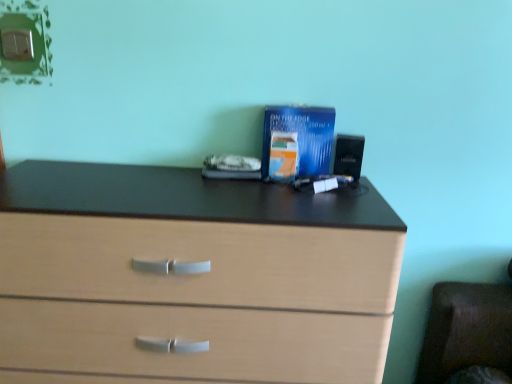
Question: Considering the relative positions of blue glossy paperback book at center, the first paperback book positioned from the back, and light wood chest of drawers at center in the image provided, is blue glossy paperback book at center, the first paperback book positioned from the back, to the left of light wood chest of drawers at center from the viewer's perspective?

Choices:
 (A) no
 (B) yes

Answer: (A)

Question: Is blue glossy paperback book at center, which appears as the second paperback book when viewed from the front, directly adjacent to light wood chest of drawers at center?

Choices:
 (A) yes
 (B) no

Answer: (B)

Question: Is blue glossy paperback book at center, the first paperback book positioned from the back, looking in the opposite direction of light wood chest of drawers at center?

Choices:
 (A) yes
 (B) no

Answer: (B)

Question: Is blue glossy paperback book at center, the first paperback book positioned from the back, not near light wood chest of drawers at center?

Choices:
 (A) no
 (B) yes

Answer: (A)

Question: From the image's perspective, is blue glossy paperback book at center, which appears as the second paperback book when viewed from the front, on top of light wood chest of drawers at center?

Choices:
 (A) yes
 (B) no

Answer: (A)

Question: From a real-world perspective, is light wood chest of drawers at center above or below blue glossy paperback book at center, the first paperback book positioned from the front?

Choices:
 (A) below
 (B) above

Answer: (A)

Question: Is point click(x=183, y=276) positioned closer to the camera than point click(x=284, y=145)?

Choices:
 (A) farther
 (B) closer

Answer: (B)

Question: Is light wood chest of drawers at center wider or thinner than blue glossy paperback book at center, the first paperback book positioned from the front?

Choices:
 (A) wide
 (B) thin

Answer: (A)

Question: Is light wood chest of drawers at center to the left or to the right of blue glossy paperback book at center, the first paperback book positioned from the front, in the image?

Choices:
 (A) right
 (B) left

Answer: (B)

Question: Considering the positions of light wood chest of drawers at center and blue glossy paperback book at center, which appears as the second paperback book when viewed from the front, in the image, is light wood chest of drawers at center taller or shorter than blue glossy paperback book at center, which appears as the second paperback book when viewed from the front,?

Choices:
 (A) tall
 (B) short

Answer: (A)

Question: Would you say light wood chest of drawers at center is to the left or to the right of blue glossy paperback book at center, which appears as the second paperback book when viewed from the front, in the picture?

Choices:
 (A) left
 (B) right

Answer: (A)

Question: Choose the correct answer: Is light wood chest of drawers at center inside blue glossy paperback book at center, the first paperback book positioned from the back, or outside it?

Choices:
 (A) outside
 (B) inside

Answer: (A)

Question: From a real-world perspective, is light wood chest of drawers at center physically located above or below blue glossy paperback book at center, the first paperback book positioned from the back?

Choices:
 (A) above
 (B) below

Answer: (B)

Question: Based on their positions, is blue glossy paperback book at center, the first paperback book positioned from the back, located to the left or right of blue glossy paperback book at center, which is the 2th paperback book from back to front?

Choices:
 (A) left
 (B) right

Answer: (B)

Question: Considering the positions of blue glossy paperback book at center, which appears as the second paperback book when viewed from the front, and blue glossy paperback book at center, which is the 2th paperback book from back to front, in the image, is blue glossy paperback book at center, which appears as the second paperback book when viewed from the front, wider or thinner than blue glossy paperback book at center, which is the 2th paperback book from back to front,?

Choices:
 (A) thin
 (B) wide

Answer: (B)